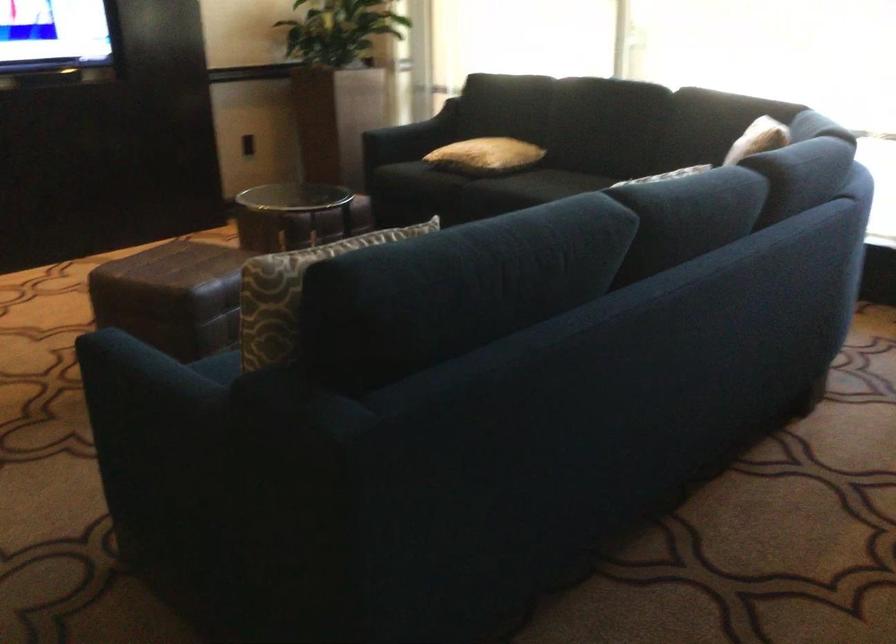
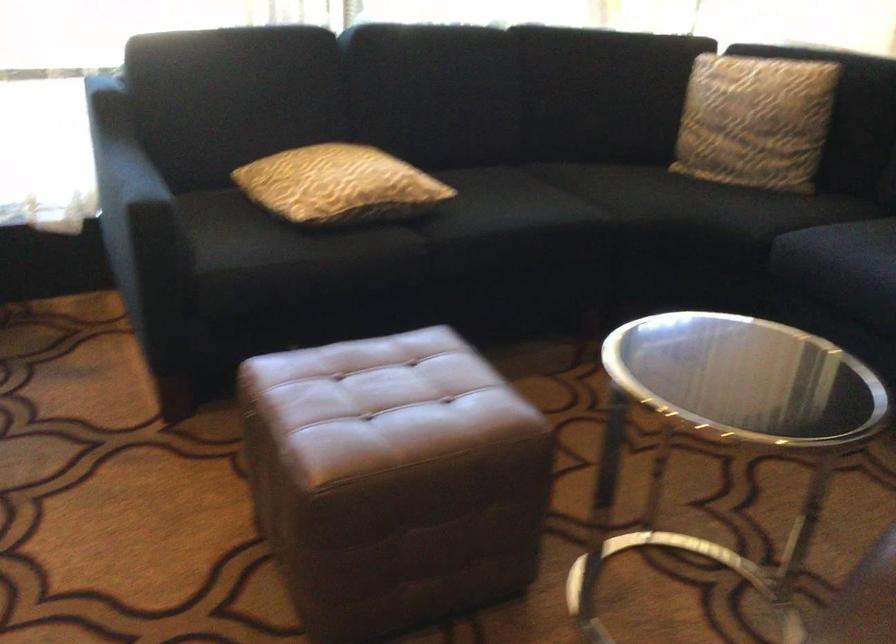
The point at (x=488, y=183) is marked in the first image. Where is the corresponding point in the second image?

(426, 227)